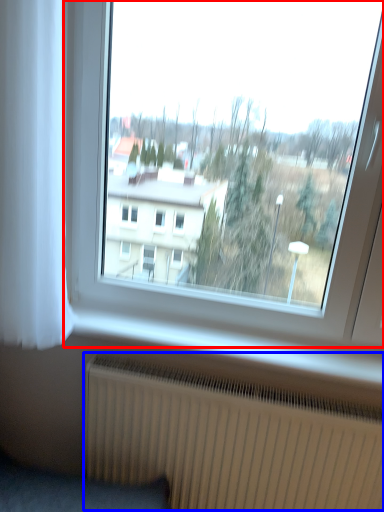
Question: Which object appears farthest to the camera in this image, window (highlighted by a red box) or radiator (highlighted by a blue box)?

Choices:
 (A) window
 (B) radiator

Answer: (B)